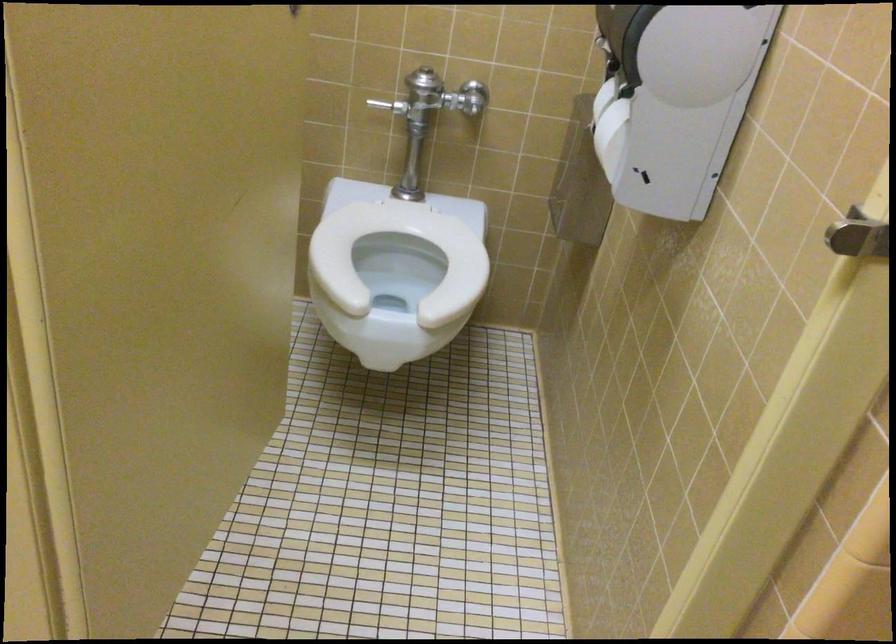
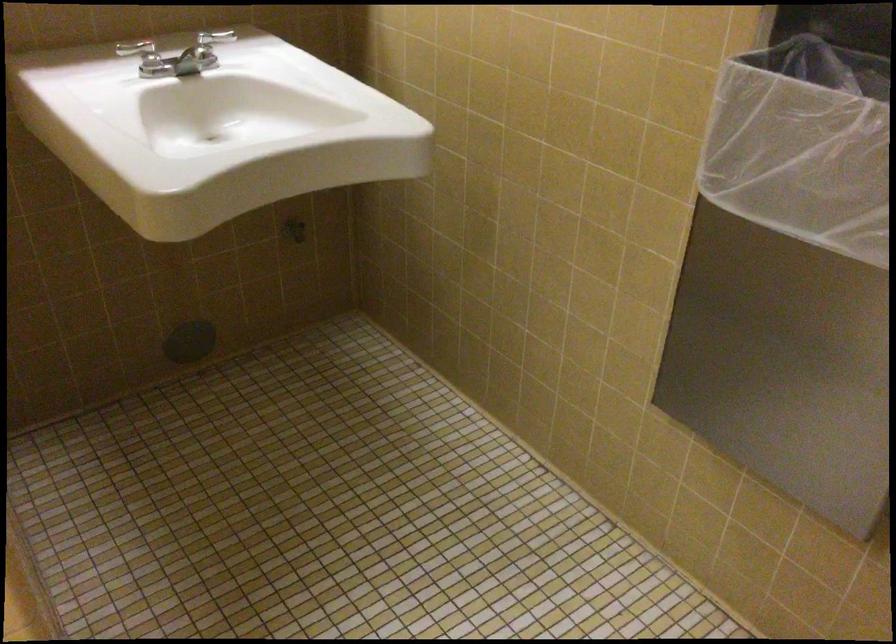
Question: How did the camera likely rotate?

Choices:
 (A) Left
 (B) Right
 (C) Up
 (D) Down

Answer: (B)